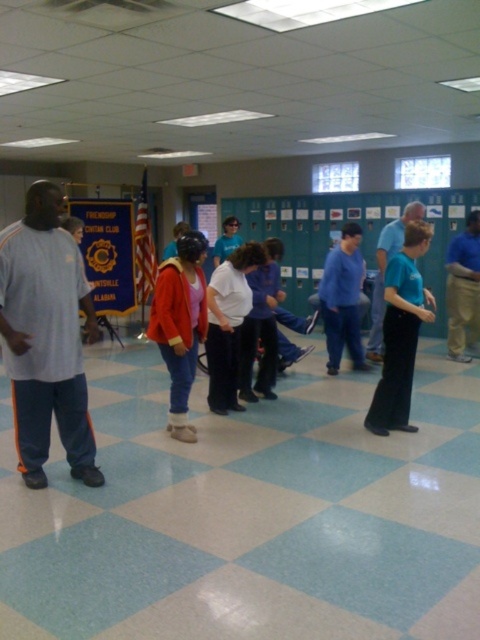
Does point (236, 376) come in front of point (379, 321)?

Yes, it is in front of point (379, 321).

The width and height of the screenshot is (480, 640). Find the location of `white matte shirt at center`. white matte shirt at center is located at coordinates (228, 323).

Is matte orange sweater at center shorter than teal matte shirt at center?

Correct, matte orange sweater at center is not as tall as teal matte shirt at center.

Between point (181, 253) and point (395, 234), which one is positioned behind?

Point (395, 234)

Locate an element on the screen. matte orange sweater at center is located at coordinates (180, 324).

Consider the image. Is blue cotton shirt at center above teal matte shirt at center?

Incorrect, blue cotton shirt at center is not positioned above teal matte shirt at center.

Which is more to the right, blue cotton shirt at center or teal matte shirt at center?

Positioned to the right is blue cotton shirt at center.

Between point (466, 227) and point (368, 352), which one is positioned behind?

The point (466, 227) is behind.

Find the location of a particular element. This screenshot has height=640, width=480. blue cotton shirt at center is located at coordinates (464, 289).